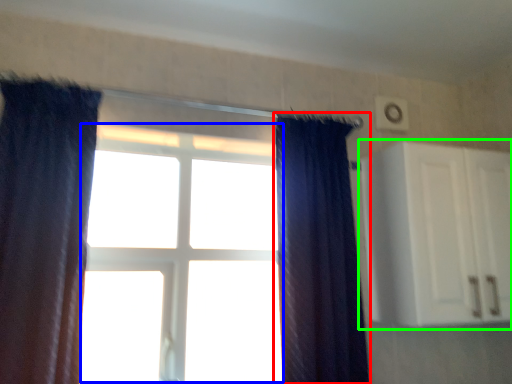
Question: Considering the real-world distances, which object is farthest from curtain (highlighted by a red box)? bay window (highlighted by a blue box) or cabinetry (highlighted by a green box)?

Choices:
 (A) bay window
 (B) cabinetry

Answer: (A)